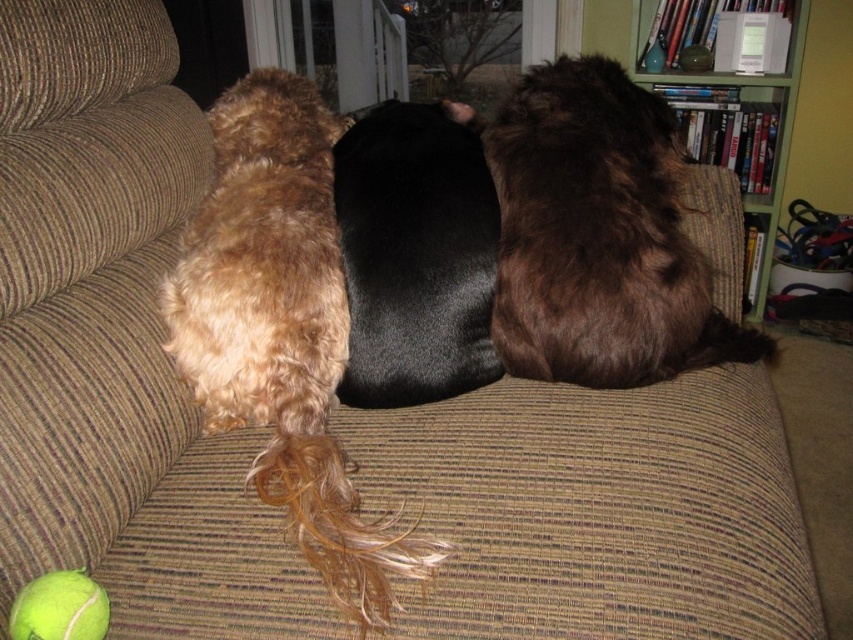
Consider the image. You are a photographer trying to capture a closeup of the shaggy golden fur at center. If your camera has a minimum focusing distance of 30 inches, can you take the photo without moving the camera closer?

The shaggy golden fur at center is 31.46 inches away from the camera. Since the minimum focusing distance is 30 inches, the photographer can take the closeup without moving the camera closer because the distance is within the camera s capability.

You are a dog groomer assessing two dogs on a couch. You need to determine which dog has a larger fur area based on their descriptions. The dogs are the shaggy golden fur at center and the black smooth fur at center. Which dog has a larger fur area?

The shaggy golden fur at center has a larger fur area than the black smooth fur at center.